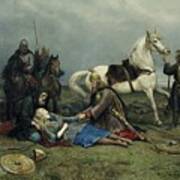
I want to click on artwork, so click(x=104, y=48).